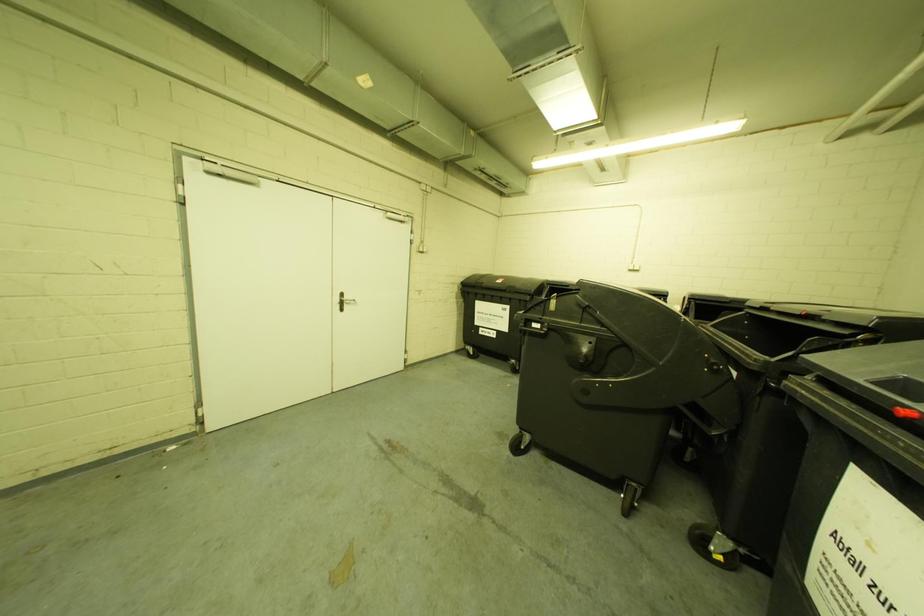
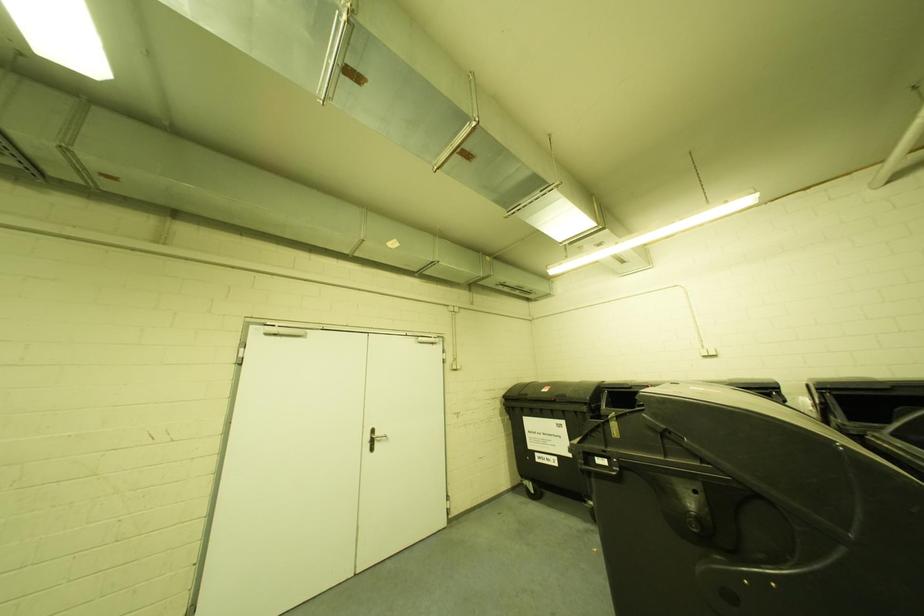
Question: The images are taken continuously from a first-person perspective. In which direction is your viewpoint rotating?

Choices:
 (A) Left
 (B) Right
 (C) Up
 (D) Down

Answer: (C)